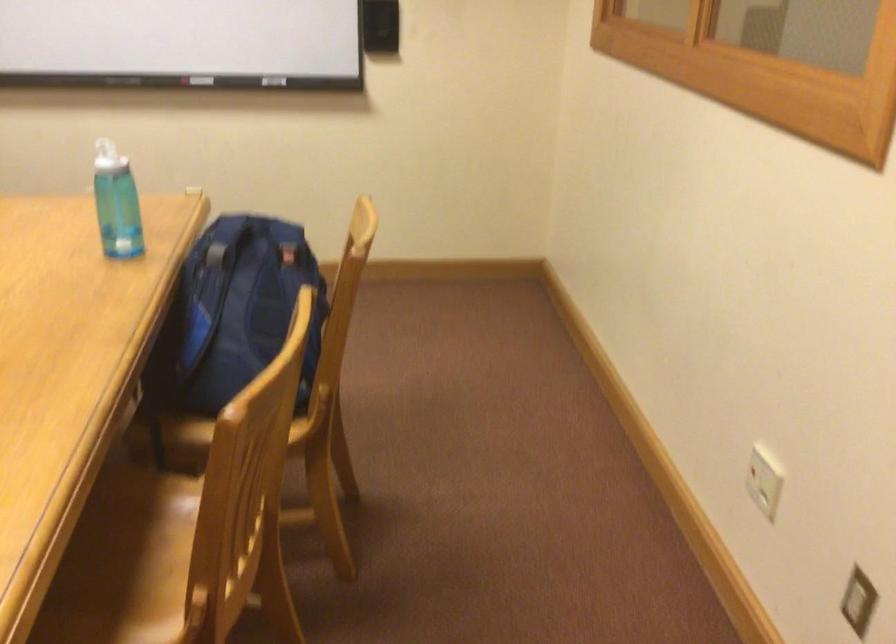
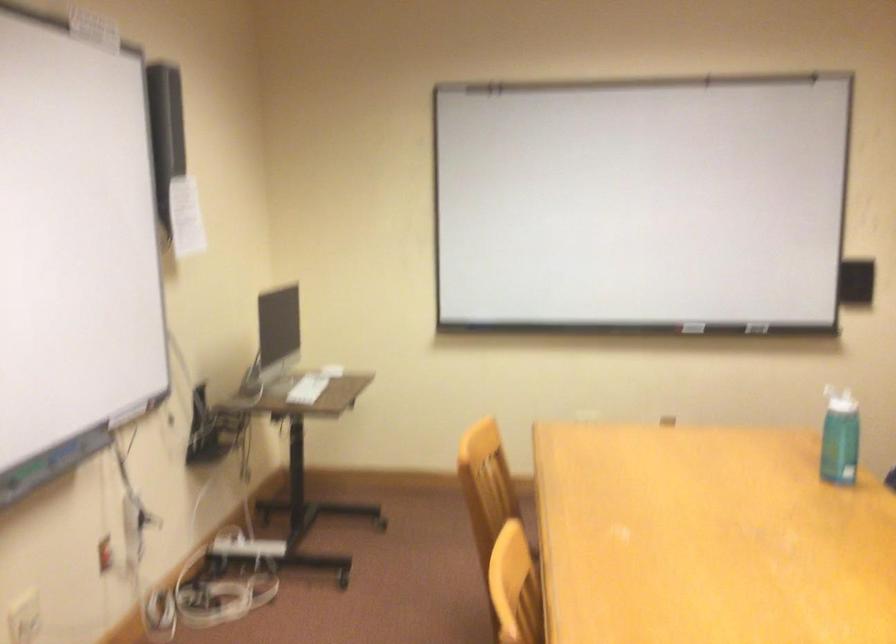
The images are taken continuously from a first-person perspective. In which direction are you moving?

The cameraman moved toward left, backward.